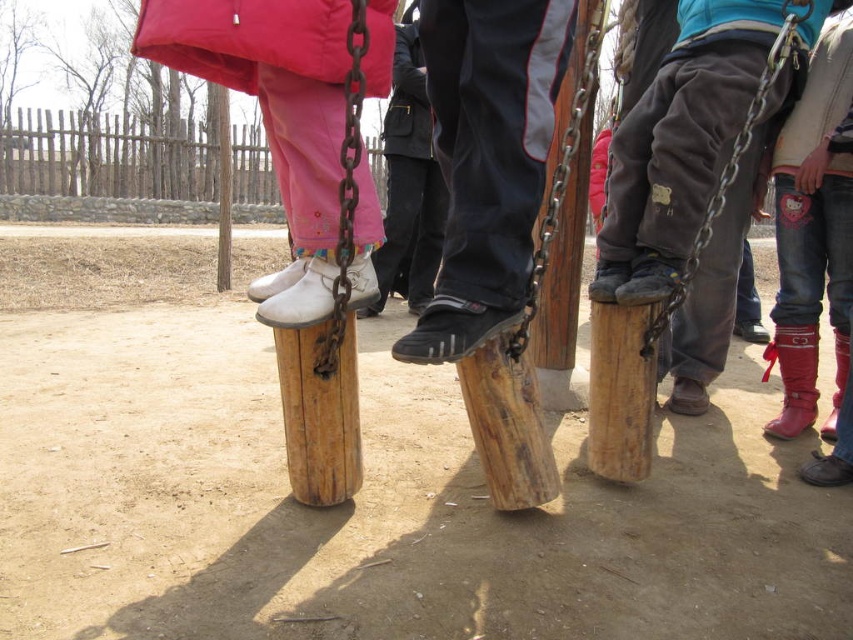
Is point (547, 24) positioned before point (804, 168)?

That is True.

Does point (431, 1) come farther from viewer compared to point (805, 198)?

That is False.

Identify the location of black leather shoe at center. (486, 160).

Does red leather boots at lower right appear on the right side of wooden post at center?

Correct, you'll find red leather boots at lower right to the right of wooden post at center.

Between point (808, 397) and point (317, 396), which one is positioned behind?

Point (808, 397)

Where is `red leather boots at lower right`? red leather boots at lower right is located at coordinates (811, 236).

Does wooden post at center lie in front of dark gray fabric pants at center?

Yes, it is in front of dark gray fabric pants at center.

Between wooden post at center and dark gray fabric pants at center, which one appears on the right side from the viewer's perspective?

Positioned to the right is dark gray fabric pants at center.

Where is `wooden post at center`? wooden post at center is located at coordinates (328, 337).